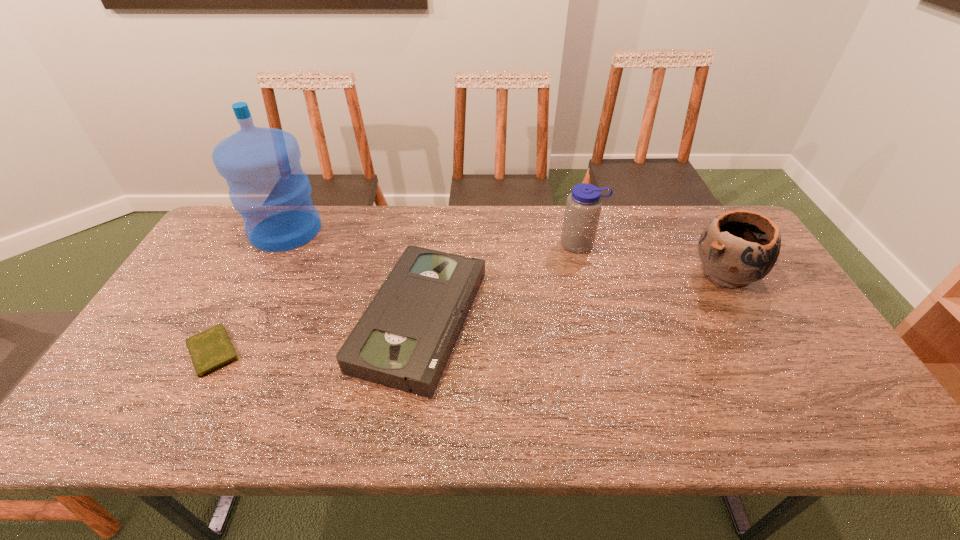
Find the location of a particular element. The height and width of the screenshot is (540, 960). water jug is located at coordinates (267, 186).

Find the location of `the second object from right to left`. the second object from right to left is located at coordinates (583, 206).

This screenshot has width=960, height=540. Find the location of `pottery`. pottery is located at coordinates (738, 247).

The height and width of the screenshot is (540, 960). In order to click on the fourth tallest object in this screenshot , I will do `click(403, 340)`.

Find the location of `videotape`. videotape is located at coordinates (403, 340).

The height and width of the screenshot is (540, 960). I want to click on the shortest object, so click(x=211, y=349).

This screenshot has width=960, height=540. In order to click on free location located 0.250m on the front of the water jug in this screenshot , I will do `click(244, 313)`.

The width and height of the screenshot is (960, 540). In order to click on free space located with a carrying loop on the side of the water bottle in this screenshot , I will do `click(589, 279)`.

Locate an element on the screen. This screenshot has height=540, width=960. free space located 0.280m on the left of the pottery is located at coordinates pyautogui.click(x=595, y=273).

The image size is (960, 540). Identify the location of free location located on the left of the videotape. (232, 320).